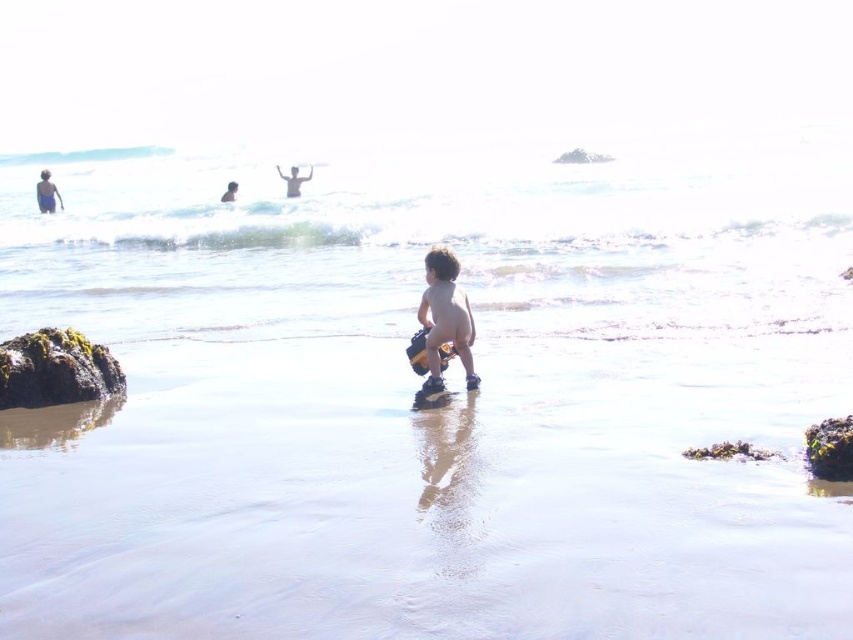
Is smooth sand at center positioned in front of clear water at lower center?

Yes, it is in front of clear water at lower center.

Is smooth sand at center above clear water at lower center?

Actually, smooth sand at center is below clear water at lower center.

Where is `smooth sand at center`? The height and width of the screenshot is (640, 853). smooth sand at center is located at coordinates (433, 497).

What do you see at coordinates (55, 369) in the screenshot?
I see `green mossy rock at lower left` at bounding box center [55, 369].

Which of these two, green mossy rock at lower left or skinny white person at upper center, stands taller?

Standing taller between the two is skinny white person at upper center.

This screenshot has width=853, height=640. Identify the location of green mossy rock at lower left. (55, 369).

Does point (456, 260) come behind point (297, 177)?

No, (456, 260) is closer to viewer.

Which of these two, smooth skin boy at center or skinny white person at upper center, stands shorter?

Standing shorter between the two is smooth skin boy at center.

Describe the element at coordinates (445, 317) in the screenshot. The height and width of the screenshot is (640, 853). I see `smooth skin boy at center` at that location.

Find the location of a particular element. The image size is (853, 640). smooth skin boy at center is located at coordinates (445, 317).